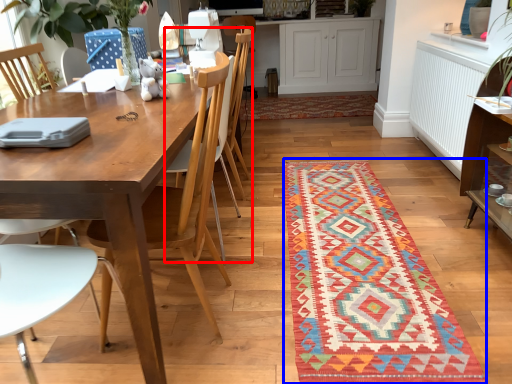
Question: Which object is further to the camera taking this photo, armchair (highlighted by a red box) or mat (highlighted by a blue box)?

Choices:
 (A) armchair
 (B) mat

Answer: (A)